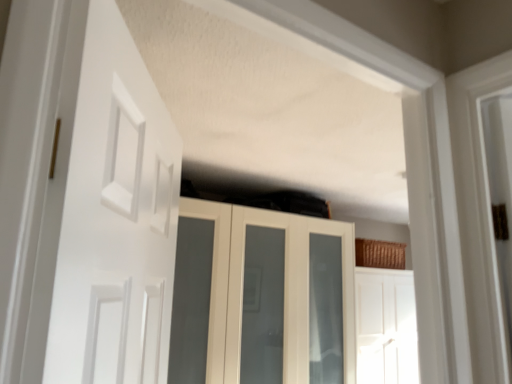
Question: From the image's perspective, is white glossy door at center, placed as the first door when sorted from back to front, located above white matte door at left, which is counted as the second door, starting from the right?

Choices:
 (A) yes
 (B) no

Answer: (B)

Question: Is white glossy door at center, arranged as the first door when viewed from the right, far away from white matte door at left, which is counted as the second door, starting from the right?

Choices:
 (A) yes
 (B) no

Answer: (A)

Question: Can you confirm if white glossy door at center, placed as the first door when sorted from back to front, is positioned to the right of white matte door at left, which appears as the 1th door when viewed from the top?

Choices:
 (A) yes
 (B) no

Answer: (A)

Question: Is white matte door at left, the 1th door when ordered from left to right, completely or partially inside white glossy door at center, placed as the first door when sorted from back to front?

Choices:
 (A) no
 (B) yes

Answer: (A)

Question: Does white glossy door at center, the 2th door viewed from the front, have a lesser height compared to white matte door at left, the 1th door when ordered from left to right?

Choices:
 (A) yes
 (B) no

Answer: (B)

Question: Is white glossy cupboard at upper center wider or thinner than white glossy door at center, arranged as the first door when viewed from the right?

Choices:
 (A) wide
 (B) thin

Answer: (A)

Question: Considering the positions of white glossy cupboard at upper center and white glossy door at center, placed as the first door when sorted from back to front, in the image, is white glossy cupboard at upper center bigger or smaller than white glossy door at center, placed as the first door when sorted from back to front,?

Choices:
 (A) small
 (B) big

Answer: (B)

Question: Is white glossy cupboard at upper center in front of or behind white glossy door at center, the second door in the top-to-bottom sequence, in the image?

Choices:
 (A) front
 (B) behind

Answer: (A)

Question: Do you think white glossy cupboard at upper center is within white glossy door at center, the 2th door viewed from the front, or outside of it?

Choices:
 (A) inside
 (B) outside

Answer: (B)

Question: From their relative heights in the image, would you say white matte door at left, the 1th door when ordered from left to right, is taller or shorter than white glossy door at center, the 2th door viewed from the front?

Choices:
 (A) short
 (B) tall

Answer: (A)

Question: Is point (136, 114) closer or farther from the camera than point (393, 332)?

Choices:
 (A) closer
 (B) farther

Answer: (A)

Question: Looking at the image, does white matte door at left, the 2th door in the back-to-front sequence, seem bigger or smaller compared to white glossy door at center, placed as the first door when sorted from back to front?

Choices:
 (A) small
 (B) big

Answer: (A)

Question: From a real-world perspective, is white matte door at left, which is counted as the second door, starting from the bottom, above or below white glossy door at center, placed as the first door when sorted from back to front?

Choices:
 (A) above
 (B) below

Answer: (A)

Question: From their relative heights in the image, would you say white matte door at left, which is counted as the second door, starting from the right, is taller or shorter than white glossy cupboard at upper center?

Choices:
 (A) tall
 (B) short

Answer: (B)

Question: From the image's perspective, is white matte door at left, the 1th door when ordered from left to right, positioned above or below white glossy cupboard at upper center?

Choices:
 (A) below
 (B) above

Answer: (B)